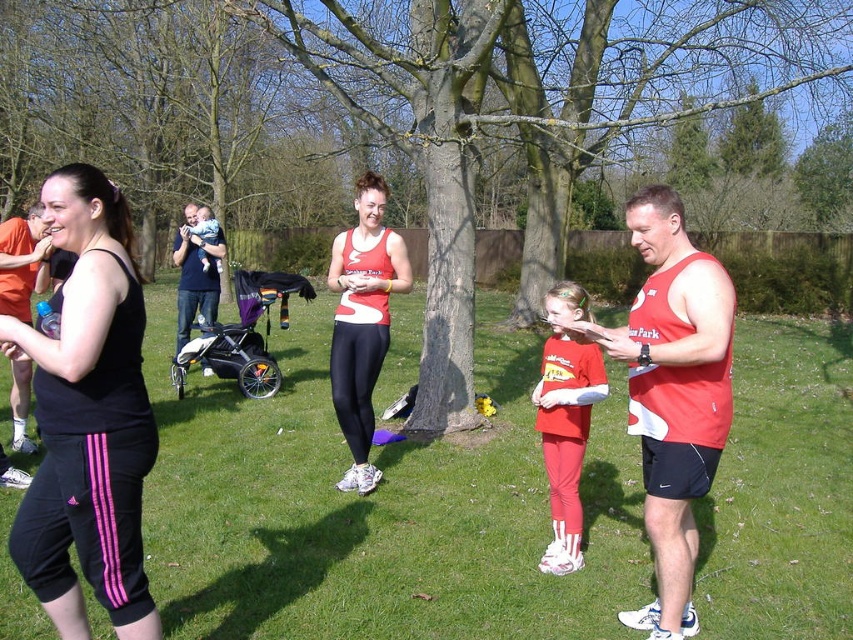
You are a photographer trying to capture a group photo of the matte red tank top at center and the matte black tank top at left. Since you want both subjects to appear the same height in the photo, which one should stand closer to the camera?

The matte black tank top at left should stand closer to the camera because it is shorter than the matte red tank top at center. By positioning the shorter person closer, their apparent height in the photo will be balanced with the taller individual.

You are standing at the origin point in the park scene. A black matte tank top at left is located at coordinate point (88, 419). If you want to walk directly to the black matte tank top at left, which direction should you move?

To reach the black matte tank top at left located at coordinate point (88, 419), you should move towards the left since the x coordinate 0.655 is to the right of the origin, and the y coordinate 0.104 is slightly downward from the center. However, since the object is labeled as being at the left, there might be a coordinate system where higher x values indicate rightward direction, so moving right would be correct. Wait, this is conflicting. Let me check the coordinate system. Typically, in image systems